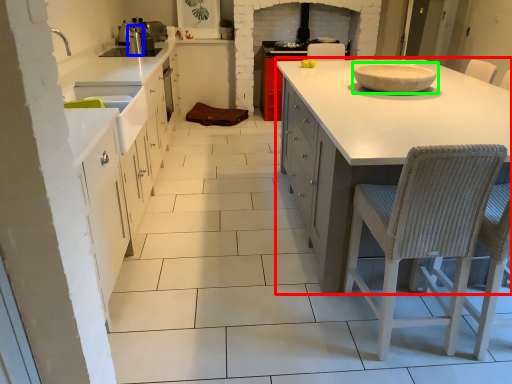
Question: Which is farther away from countertop (highlighted by a red box)? appliance (highlighted by a blue box) or bowl (highlighted by a green box)?

Choices:
 (A) appliance
 (B) bowl

Answer: (A)